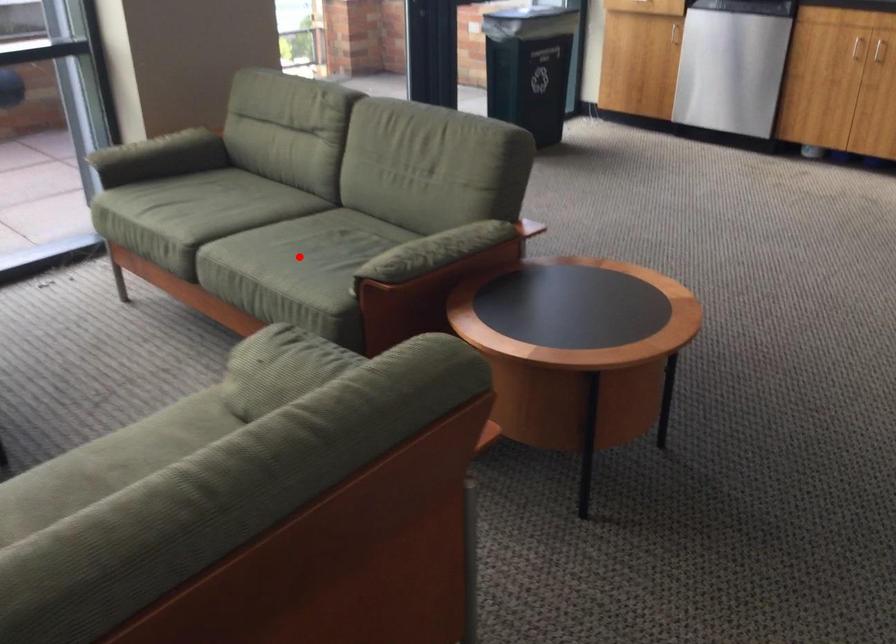
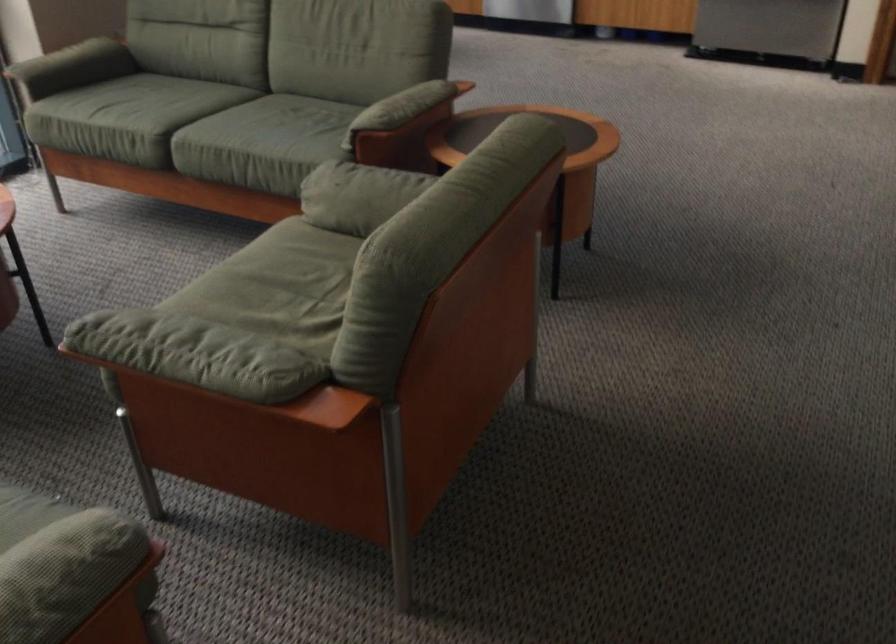
Question: I am providing you with two images of the same scene from different viewpoints. Given a red point in image1, look at the same physical point in image2. Is it:

Choices:
 (A) Closer to the viewpoint
 (B) Farther from the viewpoint

Answer: (B)